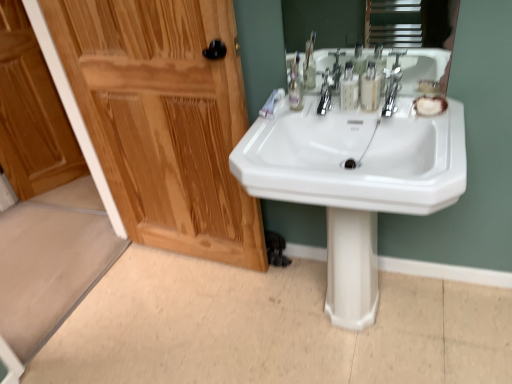
Question: Is translucent plastic mouthwash at upper center, which is counted as the 1th mouthwash, starting from the left, shorter than white matte toothpaste at upper right?

Choices:
 (A) no
 (B) yes

Answer: (A)

Question: From a real-world perspective, is translucent plastic mouthwash at upper center, which is counted as the 1th mouthwash, starting from the left, physically below white matte toothpaste at upper right?

Choices:
 (A) yes
 (B) no

Answer: (B)

Question: Is white matte toothpaste at upper right at the back of translucent plastic mouthwash at upper center, which is counted as the 1th mouthwash, starting from the left?

Choices:
 (A) yes
 (B) no

Answer: (B)

Question: Does translucent plastic mouthwash at upper center, the 2th mouthwash viewed from the right, have a smaller size compared to white matte toothpaste at upper right?

Choices:
 (A) no
 (B) yes

Answer: (A)

Question: Considering the relative sizes of translucent plastic mouthwash at upper center, the 2th mouthwash viewed from the right, and white matte toothpaste at upper right in the image provided, is translucent plastic mouthwash at upper center, the 2th mouthwash viewed from the right, thinner than white matte toothpaste at upper right?

Choices:
 (A) no
 (B) yes

Answer: (B)

Question: Is the surface of translucent plastic mouthwash at upper center, the 2th mouthwash viewed from the right, in direct contact with white matte toothpaste at upper right?

Choices:
 (A) no
 (B) yes

Answer: (A)

Question: Is wooden cabinet at left positioned before white glossy pedestal at center?

Choices:
 (A) no
 (B) yes

Answer: (A)

Question: From the image's perspective, would you say wooden cabinet at left is shown under white glossy pedestal at center?

Choices:
 (A) yes
 (B) no

Answer: (B)

Question: Considering the relative sizes of wooden cabinet at left and white glossy pedestal at center in the image provided, is wooden cabinet at left wider than white glossy pedestal at center?

Choices:
 (A) no
 (B) yes

Answer: (A)

Question: Is wooden cabinet at left not within white glossy pedestal at center?

Choices:
 (A) yes
 (B) no

Answer: (A)

Question: Is wooden cabinet at left thinner than white glossy pedestal at center?

Choices:
 (A) no
 (B) yes

Answer: (B)

Question: Considering the relative sizes of wooden cabinet at left and white glossy pedestal at center in the image provided, is wooden cabinet at left taller than white glossy pedestal at center?

Choices:
 (A) yes
 (B) no

Answer: (A)

Question: Is chrome metallic faucet at upper center oriented away from shiny wood door at left?

Choices:
 (A) yes
 (B) no

Answer: (B)